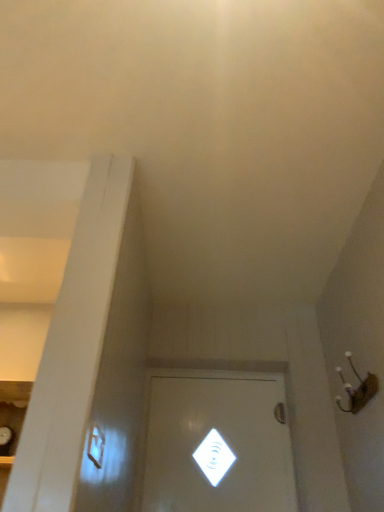
Where is `white glossy door at center`? The width and height of the screenshot is (384, 512). white glossy door at center is located at coordinates (217, 443).

Image resolution: width=384 pixels, height=512 pixels. What do you see at coordinates (217, 443) in the screenshot? I see `white glossy door at center` at bounding box center [217, 443].

At what (x,y) coordinates should I click in order to perform the action: click on white glossy door at center. Please return your answer as a coordinate pair (x, y). This screenshot has width=384, height=512. Looking at the image, I should click on (217, 443).